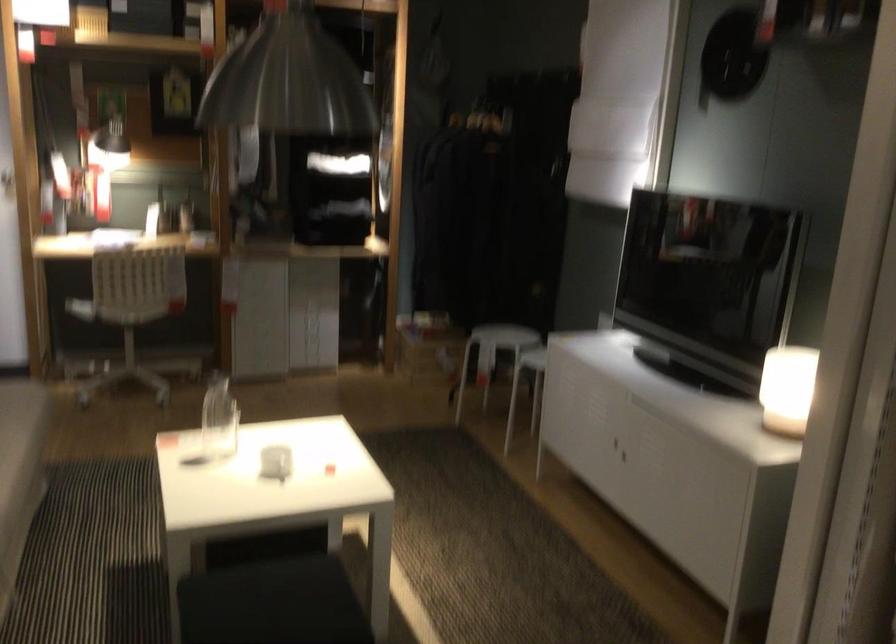
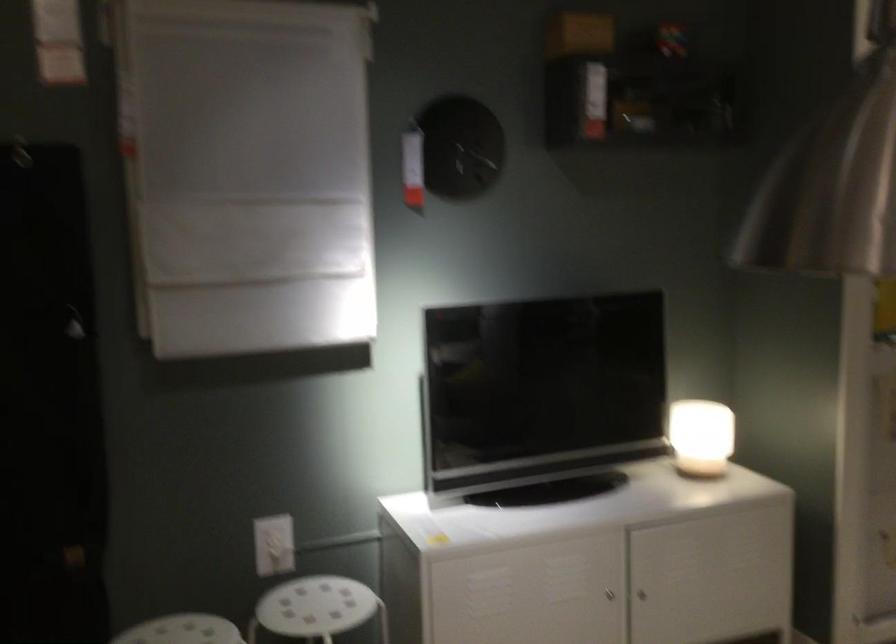
In the second image, find the point that corresponds to [615,436] in the first image.

(608, 594)